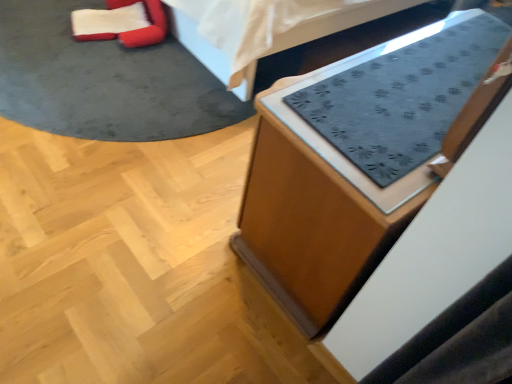
Question: In terms of height, does velvet red bean bag chair at upper left look taller or shorter compared to wooden cabinet at lower right, which ranks as the 1th furniture in bottom-to-top order?

Choices:
 (A) short
 (B) tall

Answer: (A)

Question: In terms of width, does velvet red bean bag chair at upper left look wider or thinner when compared to wooden cabinet at lower right, which is the second furniture from top to bottom?

Choices:
 (A) thin
 (B) wide

Answer: (A)

Question: Which object is the closest to the wooden cabinet at lower right, which is the second furniture from top to bottom?

Choices:
 (A) velvet red bean bag chair at upper left
 (B) dark gray fabric mat at upper center, which appears as the second furniture when ordered from the bottom

Answer: (B)

Question: Considering the real-world distances, which object is closest to the velvet red bean bag chair at upper left?

Choices:
 (A) dark gray fabric mat at upper center, which appears as the second furniture when ordered from the bottom
 (B) wooden cabinet at lower right, which is the second furniture from top to bottom

Answer: (A)